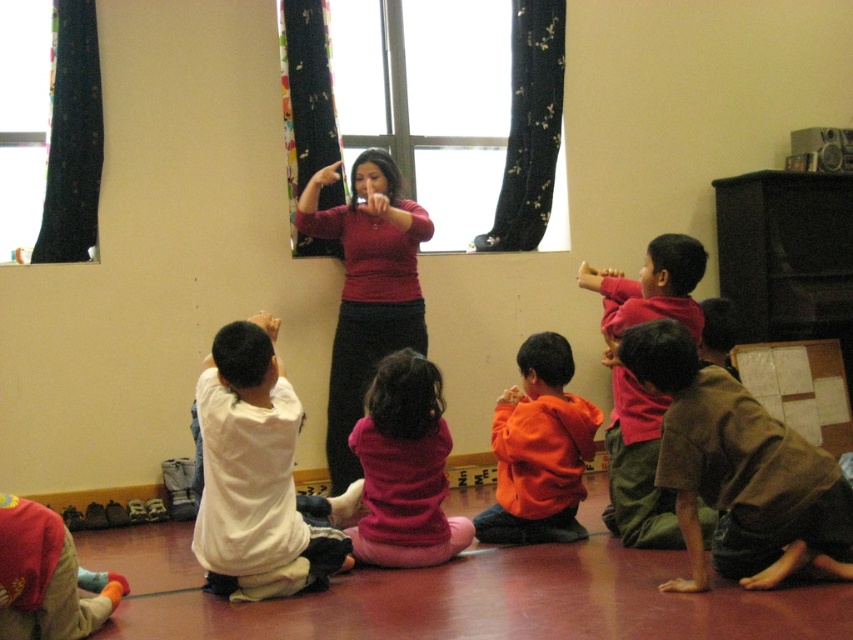
Question: Which object is positioned farthest from the orange fleece sweater at lower center?

Choices:
 (A) pink fleece sweater at center
 (B) white soft pants at lower left
 (C) orange fleece sweater at center

Answer: (B)

Question: Is black floral fabric at upper center below white soft pants at lower left?

Choices:
 (A) yes
 (B) no

Answer: (B)

Question: Does brown cotton shirt at lower right appear under pink fleece sweater at center?

Choices:
 (A) no
 (B) yes

Answer: (A)

Question: Which point is farther from the camera taking this photo?

Choices:
 (A) (567, 532)
 (B) (409, 221)
 (C) (299, 179)

Answer: (C)

Question: Which of the following is the farthest from the observer?

Choices:
 (A) (360, 525)
 (B) (312, 138)

Answer: (B)

Question: Can you confirm if orange fleece sweater at center is positioned to the left of dark green fabric at upper left?

Choices:
 (A) yes
 (B) no

Answer: (B)